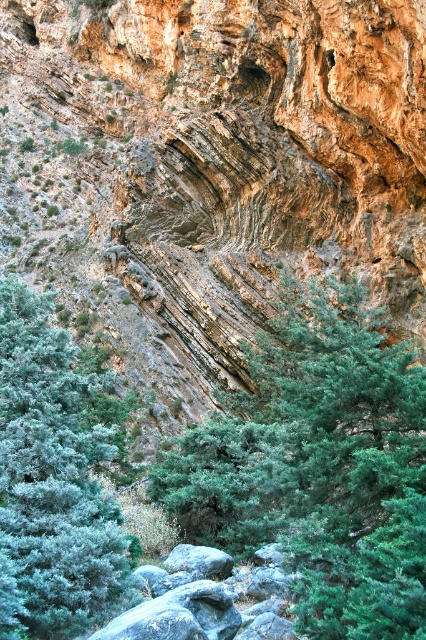
Question: Where is green leafy tree at center located in relation to green matte tree at center in the image?

Choices:
 (A) right
 (B) left

Answer: (A)

Question: Does green leafy tree at center have a lesser width compared to green matte tree at center?

Choices:
 (A) no
 (B) yes

Answer: (B)

Question: Which of the following is the closest to the observer?

Choices:
 (A) green matte tree at center
 (B) green leafy tree at center

Answer: (B)

Question: Is green leafy tree at center smaller than green matte tree at center?

Choices:
 (A) yes
 (B) no

Answer: (A)

Question: Which point is farther to the camera?

Choices:
 (A) (169, 477)
 (B) (60, 336)

Answer: (A)